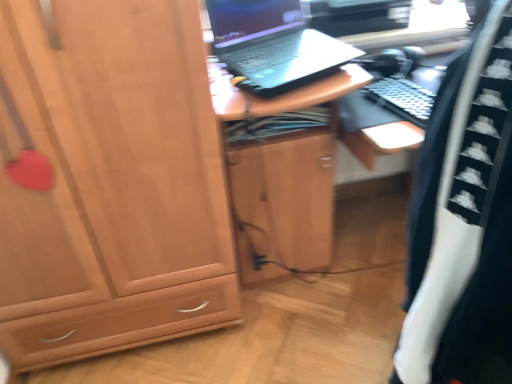
This screenshot has height=384, width=512. Describe the element at coordinates (273, 45) in the screenshot. I see `black matte laptop at upper center` at that location.

Image resolution: width=512 pixels, height=384 pixels. I want to click on black matte laptop at upper center, so click(273, 45).

From a real-world perspective, is black/white fabric at right beneath matte wood cabinet at left?

No.

From the image's perspective, who appears lower, black/white fabric at right or matte wood cabinet at left?

black/white fabric at right appears lower in the image.

How many degrees apart are the facing directions of black/white fabric at right and matte wood cabinet at left?

The facing directions of black/white fabric at right and matte wood cabinet at left are 116 degrees apart.

Which of these two, black/white fabric at right or matte wood cabinet at left, is thinner?

black/white fabric at right is thinner.

Where is `cabinetry beneath the black matte laptop at upper center (from a real-world perspective)`? This screenshot has width=512, height=384. cabinetry beneath the black matte laptop at upper center (from a real-world perspective) is located at coordinates (112, 182).

Looking at this image, is the depth of matte wood cabinet at left greater than that of black matte laptop at upper center?

That is False.

Would you say matte wood cabinet at left contains black matte laptop at upper center?

No, black matte laptop at upper center is not a part of matte wood cabinet at left.

Between black matte laptop at upper center and matte wood cabinet at left, which one is positioned behind?

black matte laptop at upper center is behind.

In the scene shown: From a real-world perspective, which object rests below the other?

matte wood cabinet at left.

Is black matte laptop at upper center not close to matte wood cabinet at left?

That's not correct — black matte laptop at upper center is a little close to matte wood cabinet at left.

Can you confirm if black matte laptop at upper center is wider than matte wood cabinet at left?

No.

Is matte wood cabinet at left far from black/white fabric at right?

They are positioned close to each other.

Considering the positions of objects matte wood cabinet at left and black/white fabric at right in the image provided, who is more to the left, matte wood cabinet at left or black/white fabric at right?

Positioned to the left is matte wood cabinet at left.

Which is farther from the camera, (129,78) or (485,237)?

The point (129,78) is behind.

Based on the photo, can you tell me how much black matte laptop at upper center and black/white fabric at right differ in facing direction?

The facing directions of black matte laptop at upper center and black/white fabric at right are 91.7 degrees apart.

Considering the relative sizes of black matte laptop at upper center and black/white fabric at right in the image provided, is black matte laptop at upper center taller than black/white fabric at right?

No, black matte laptop at upper center is not taller than black/white fabric at right.

Considering the positions of objects black matte laptop at upper center and black/white fabric at right in the image provided, who is more to the right, black matte laptop at upper center or black/white fabric at right?

black/white fabric at right is more to the right.

Is black matte laptop at upper center further to camera compared to black/white fabric at right?

Yes.

From the image's perspective, is black/white fabric at right located beneath black matte laptop at upper center?

Correct, black/white fabric at right appears lower than black matte laptop at upper center in the image.

Does point (448, 340) come in front of point (276, 56)?

Yes, it is in front of point (276, 56).

Which of these two, black/white fabric at right or black matte laptop at upper center, is bigger?

With larger size is black/white fabric at right.

In the image, there is a black/white fabric at right. Identify the location of cabinetry above it (from the image's perspective). The image size is (512, 384). (112, 182).

I want to click on cabinetry located in front of the black matte laptop at upper center, so click(x=112, y=182).

Consider the image. Estimate the real-world distances between objects in this image. Which object is further from black/white fabric at right, black matte laptop at upper center or matte wood cabinet at left?

The object further to black/white fabric at right is black matte laptop at upper center.

Considering their positions, is matte wood cabinet at left positioned closer to black/white fabric at right than black matte laptop at upper center?

matte wood cabinet at left is positioned closer to the anchor black/white fabric at right.

From the image, which object appears to be farther from matte wood cabinet at left, black/white fabric at right or black matte laptop at upper center?

Among the two, black/white fabric at right is located further to matte wood cabinet at left.

Which object lies nearer to the anchor point black matte laptop at upper center, black/white fabric at right or matte wood cabinet at left?

Based on the image, matte wood cabinet at left appears to be nearer to black matte laptop at upper center.

Based on their spatial positions, is matte wood cabinet at left or black/white fabric at right further from black matte laptop at upper center?

black/white fabric at right is positioned further to the anchor black matte laptop at upper center.

From the image, which object appears to be farther from matte wood cabinet at left, black matte laptop at upper center or black/white fabric at right?

black/white fabric at right is positioned further to the anchor matte wood cabinet at left.

Image resolution: width=512 pixels, height=384 pixels. Find the location of `laptop between matte wood cabinet at left and black/white fabric at right in the horizontal direction`. laptop between matte wood cabinet at left and black/white fabric at right in the horizontal direction is located at coordinates (273, 45).